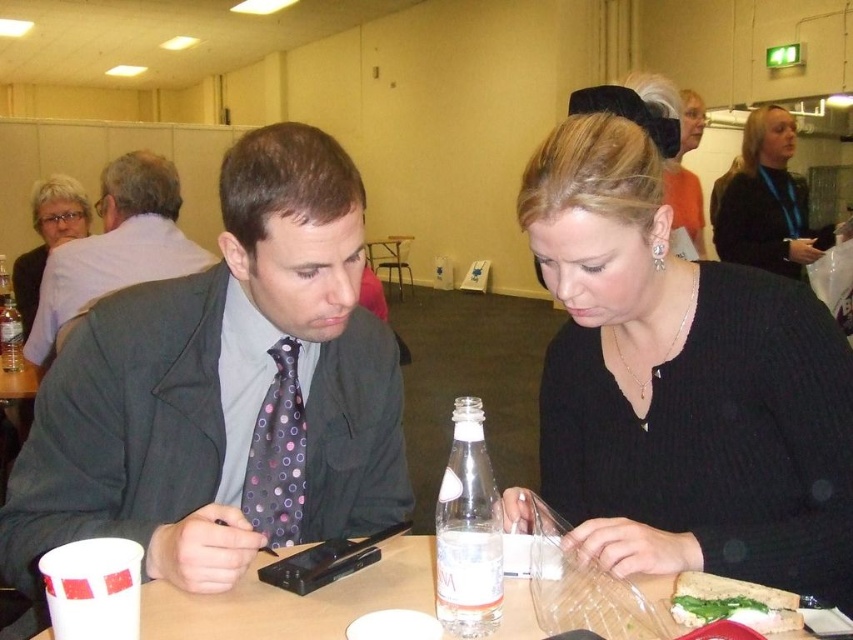
You are a photographer setting up for a group photo in the conference room. You notice the dark gray suit at left and the clear glass bottle at left. Which object should you avoid placing any heavy equipment on to prevent damage?

The clear glass bottle at left should be avoided because the dark gray suit at left is positioned over it, meaning the bottle is underneath and could break if something heavy is placed on top.

You are a photographer taking a picture of the scene. You want to ensure both the black knitwear at center and the dark gray suit at left are in focus. Which object should you adjust your camera focus to prioritize to ensure both are sharp?

The black knitwear at center is closer to the viewer than the dark gray suit at left. To ensure both are in focus, prioritize focusing on the dark gray suit at left since it is farther away, allowing the depth of field to cover the closer black knitwear at center.

You are a photographer in the conference room. You need to take a photo of the dark gray suit at left and the black knitwear at center. Based on their positions, which object should you focus on first to ensure both are in frame?

The black knitwear at center is below dark gray suit at left, so you should focus on the dark gray suit at left first to ensure both are in frame.